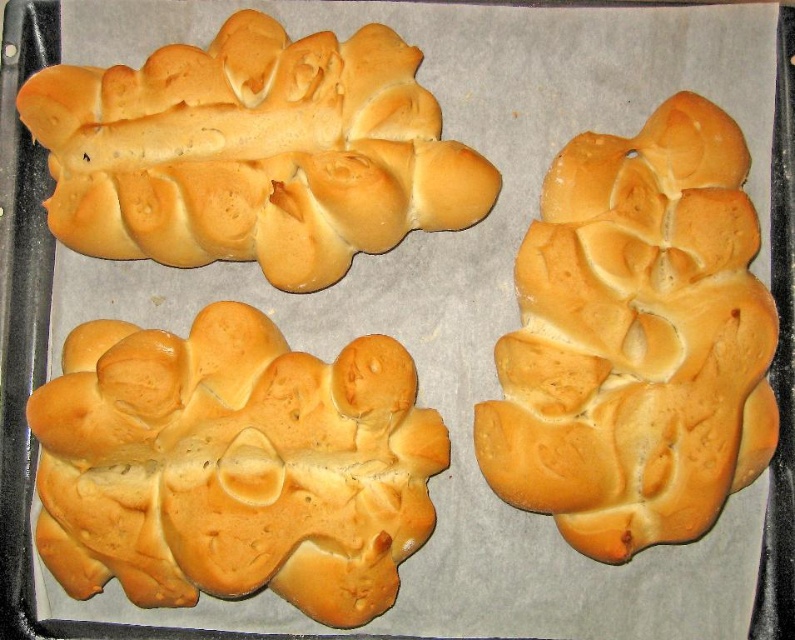
Does point (529, 499) come in front of point (340, 148)?

That is True.

Is golden-brown crusty bread at center-right taller than golden-brown crusty bread at upper left?

→ Correct, golden-brown crusty bread at center-right is much taller as golden-brown crusty bread at upper left.

What do you see at coordinates (636, 339) in the screenshot? I see `golden-brown crusty bread at center-right` at bounding box center [636, 339].

Locate an element on the screen. This screenshot has width=795, height=640. golden-brown crusty bread at center-right is located at coordinates (636, 339).

Who is higher up, golden-brown crusty loaf at center or golden-brown crusty bread at center-right?

Positioned higher is golden-brown crusty bread at center-right.

Is the position of golden-brown crusty loaf at center less distant than that of golden-brown crusty bread at center-right?

That is False.

I want to click on golden-brown crusty loaf at center, so click(233, 465).

You are a GUI agent. You are given a task and a screenshot of the screen. Output one action in this format:
    pyautogui.click(x=<x>, y=<y>)
    Task: Click on the golden-brown crusty loaf at center
    
    Given the screenshot: What is the action you would take?
    pyautogui.click(x=233, y=465)

Image resolution: width=795 pixels, height=640 pixels. What do you see at coordinates (233, 465) in the screenshot?
I see `golden-brown crusty loaf at center` at bounding box center [233, 465].

Which is in front, point (57, 390) or point (148, 161)?

Point (57, 390) is more forward.

The image size is (795, 640). What do you see at coordinates (233, 465) in the screenshot? I see `golden-brown crusty loaf at center` at bounding box center [233, 465].

Locate an element on the screen. This screenshot has width=795, height=640. golden-brown crusty loaf at center is located at coordinates (233, 465).